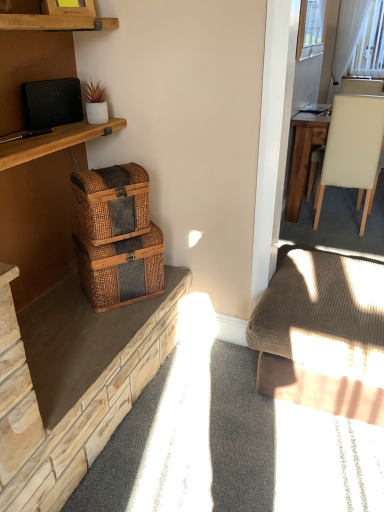
The image size is (384, 512). What do you see at coordinates (112, 202) in the screenshot? I see `woven brown picnic basket at left, placed as the 1th picnic basket when sorted from top to bottom` at bounding box center [112, 202].

What is the approximate width of black matte speaker at upper left?

black matte speaker at upper left is 1.22 inches wide.

Describe the element at coordinates (95, 103) in the screenshot. I see `white matte pot at upper left` at that location.

Describe the element at coordinates (73, 383) in the screenshot. I see `woven wood baskets at left` at that location.

Locate an element on the screen. beige leather chair at right is located at coordinates (353, 150).

From the image's perspective, which is below, woven brown picnic basket at left, which appears as the second picnic basket when ordered from the bottom, or white matte pot at upper left?

woven brown picnic basket at left, which appears as the second picnic basket when ordered from the bottom.

Is woven brown picnic basket at left, placed as the 1th picnic basket when sorted from top to bottom, to the left or to the right of white matte pot at upper left in the image?

Based on their positions, woven brown picnic basket at left, placed as the 1th picnic basket when sorted from top to bottom, is located to the right of white matte pot at upper left.

Can we say woven brown picnic basket at left, placed as the 1th picnic basket when sorted from top to bottom, lies outside white matte pot at upper left?

That's correct, woven brown picnic basket at left, placed as the 1th picnic basket when sorted from top to bottom, is outside of white matte pot at upper left.

Considering their positions, is white sheer curtain at upper right located in front of or behind white matte pot at upper left?

In the image, white sheer curtain at upper right appears behind white matte pot at upper left.

From the image's perspective, which object appears higher, white sheer curtain at upper right or white matte pot at upper left?

white sheer curtain at upper right is shown above in the image.

Is white sheer curtain at upper right oriented away from white matte pot at upper left?

white sheer curtain at upper right is not turned away from white matte pot at upper left.

Can you confirm if white sheer curtain at upper right is taller than white matte pot at upper left?

Indeed, white sheer curtain at upper right has a greater height compared to white matte pot at upper left.

In the scene shown: Is white sheer curtain at upper right positioned with its back to beige leather chair at right?

That's not correct — white sheer curtain at upper right is not looking away from beige leather chair at right.

Image resolution: width=384 pixels, height=512 pixels. Find the location of `chair lying below the white sheer curtain at upper right (from the image's perspective)`. chair lying below the white sheer curtain at upper right (from the image's perspective) is located at coordinates (353, 150).

What's the angular difference between white sheer curtain at upper right and beige leather chair at right's facing directions?

The angular difference between white sheer curtain at upper right and beige leather chair at right is 180 degrees.

Which of these two, white sheer curtain at upper right or beige leather chair at right, is bigger?

Bigger between the two is beige leather chair at right.

Based on the photo, which of these two, woven wood baskets at left or beige leather chair at right, stands shorter?

woven wood baskets at left.

You are a GUI agent. You are given a task and a screenshot of the screen. Output one action in this format:
    pyautogui.click(x=<x>, y=<y>)
    Task: Click on the chair that appears above the woven wood baskets at left (from the image's perspective)
    
    Given the screenshot: What is the action you would take?
    pyautogui.click(x=353, y=150)

Is woven wood baskets at left situated inside beige leather chair at right or outside?

woven wood baskets at left exists outside the volume of beige leather chair at right.

From the image's perspective, is woven wood baskets at left located above beige leather chair at right?

No, from the image's perspective, woven wood baskets at left is not above beige leather chair at right.

Looking at this image, how much distance is there between woven brown picnic basket at lower left, the 2th picnic basket viewed from the top, and white sheer curtain at upper right?

The distance of woven brown picnic basket at lower left, the 2th picnic basket viewed from the top, from white sheer curtain at upper right is 3.91 meters.

How different are the orientations of woven brown picnic basket at lower left, placed as the first picnic basket when sorted from bottom to top, and white sheer curtain at upper right in degrees?

The angle between the facing direction of woven brown picnic basket at lower left, placed as the first picnic basket when sorted from bottom to top, and the facing direction of white sheer curtain at upper right is 49.5 degrees.

From the image's perspective, which one is positioned higher, woven brown picnic basket at lower left, the 2th picnic basket viewed from the top, or white sheer curtain at upper right?

white sheer curtain at upper right is shown above in the image.

From a real-world perspective, is woven brown picnic basket at lower left, the 2th picnic basket viewed from the top, above or below white sheer curtain at upper right?

In terms of real-world spatial position, woven brown picnic basket at lower left, the 2th picnic basket viewed from the top, is below white sheer curtain at upper right.

Can you confirm if woven brown picnic basket at lower left, placed as the first picnic basket when sorted from bottom to top, is taller than ribbed brown fabric couch at lower right?

No, woven brown picnic basket at lower left, placed as the first picnic basket when sorted from bottom to top, is not taller than ribbed brown fabric couch at lower right.

Identify the location of studio couch below the woven brown picnic basket at lower left, placed as the first picnic basket when sorted from bottom to top (from a real-world perspective). Image resolution: width=384 pixels, height=512 pixels. (323, 334).

Which of these two, woven brown picnic basket at lower left, the 2th picnic basket viewed from the top, or ribbed brown fabric couch at lower right, is smaller?

Smaller between the two is woven brown picnic basket at lower left, the 2th picnic basket viewed from the top.

Which is closer, (x=155, y=252) or (x=295, y=339)?

Point (x=155, y=252).

Does white sheer curtain at upper right appear on the right side of woven brown picnic basket at left, placed as the 1th picnic basket when sorted from top to bottom?

Yes.

How many degrees apart are the facing directions of white sheer curtain at upper right and woven brown picnic basket at left, placed as the 1th picnic basket when sorted from top to bottom?

The angle between the facing direction of white sheer curtain at upper right and the facing direction of woven brown picnic basket at left, placed as the 1th picnic basket when sorted from top to bottom, is 54.1 degrees.

Is woven brown picnic basket at left, which appears as the second picnic basket when ordered from the bottom, surrounded by white sheer curtain at upper right?

No, woven brown picnic basket at left, which appears as the second picnic basket when ordered from the bottom, is not a part of white sheer curtain at upper right.

In terms of width, does white sheer curtain at upper right look wider or thinner when compared to woven brown picnic basket at left, which appears as the second picnic basket when ordered from the bottom?

Clearly, white sheer curtain at upper right has less width compared to woven brown picnic basket at left, which appears as the second picnic basket when ordered from the bottom.

The image size is (384, 512). There is a woven brown picnic basket at left, which appears as the second picnic basket when ordered from the bottom. In order to click on houseplant above it (from a real-world perspective) in this screenshot , I will do `click(95, 103)`.

Locate an element on the screen. houseplant that is below the white sheer curtain at upper right (from the image's perspective) is located at coordinates (95, 103).

Which object lies further to the anchor point beige leather chair at right, woven wood baskets at left or woven brown picnic basket at lower left, the 2th picnic basket viewed from the top?

The object further to beige leather chair at right is woven wood baskets at left.

From the image, which object appears to be farther from white matte pot at upper left, ribbed brown fabric couch at lower right or woven brown picnic basket at left, which appears as the second picnic basket when ordered from the bottom?

Based on the image, ribbed brown fabric couch at lower right appears to be further to white matte pot at upper left.

Looking at the image, which one is located further to woven brown picnic basket at lower left, the 2th picnic basket viewed from the top, woven brown picnic basket at left, which appears as the second picnic basket when ordered from the bottom, or beige leather chair at right?

beige leather chair at right is positioned further to the anchor woven brown picnic basket at lower left, the 2th picnic basket viewed from the top.

From the image, which object appears to be farther from black matte speaker at upper left, woven wood baskets at left or beige leather chair at right?

beige leather chair at right is positioned further to the anchor black matte speaker at upper left.

From the image, which object appears to be nearer to woven brown picnic basket at left, placed as the 1th picnic basket when sorted from top to bottom, ribbed brown fabric couch at lower right or white matte pot at upper left?

white matte pot at upper left.

Looking at the image, which one is located closer to white matte pot at upper left, woven brown picnic basket at left, placed as the 1th picnic basket when sorted from top to bottom, or black matte speaker at upper left?

Among the two, black matte speaker at upper left is located nearer to white matte pot at upper left.

From the image, which object appears to be nearer to beige leather chair at right, white matte pot at upper left or woven brown picnic basket at left, placed as the 1th picnic basket when sorted from top to bottom?

white matte pot at upper left.

Estimate the real-world distances between objects in this image. Which object is closer to woven brown picnic basket at left, placed as the 1th picnic basket when sorted from top to bottom, woven brown picnic basket at lower left, placed as the first picnic basket when sorted from bottom to top, or woven wood baskets at left?

Based on the image, woven brown picnic basket at lower left, placed as the first picnic basket when sorted from bottom to top, appears to be nearer to woven brown picnic basket at left, placed as the 1th picnic basket when sorted from top to bottom.

Locate an element on the screen. chair between black matte speaker at upper left and white sheer curtain at upper right in the front-back direction is located at coordinates (353, 150).

Find the location of a particular element. This screenshot has height=512, width=384. houseplant positioned between woven wood baskets at left and white sheer curtain at upper right from near to far is located at coordinates (x=95, y=103).

The width and height of the screenshot is (384, 512). What are the coordinates of `picnic basket between black matte speaker at upper left and woven brown picnic basket at lower left, placed as the first picnic basket when sorted from bottom to top, vertically` in the screenshot? It's located at (112, 202).

At what (x,y) coordinates should I click in order to perform the action: click on studio couch situated between woven brown picnic basket at left, which appears as the second picnic basket when ordered from the bottom, and beige leather chair at right from left to right. Please return your answer as a coordinate pair (x, y). The height and width of the screenshot is (512, 384). Looking at the image, I should click on (323, 334).